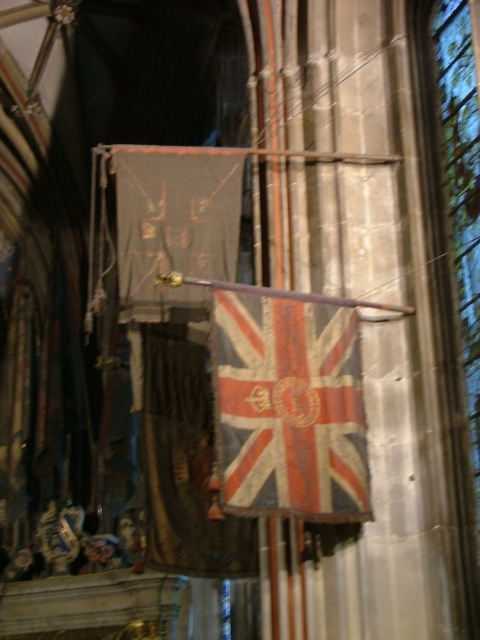
You are a visitor in the church and want to see both the worn fabric flag at center and the transparent stained glass at right clearly. Which one will you need to look upwards to see?

The transparent stained glass at right is above the worn fabric flag at center, so you will need to look upwards to see the transparent stained glass at right.

You are standing inside the cathedral and want to take a photo of both the worn fabric flag at center and the transparent stained glass at right. Since the lighting is dim, you need to ensure both subjects are well lit. Which object should you position closer to the light source to achieve better illumination?

The worn fabric flag at center is closer to the viewer than the transparent stained glass at right, so you should position the transparent stained glass at right closer to the light source to ensure it receives enough illumination.